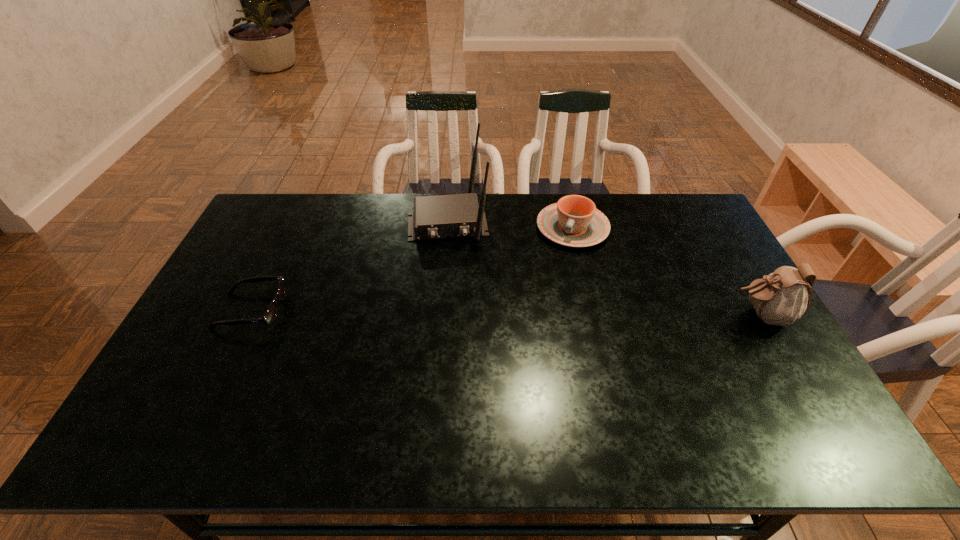
I want to click on free space on the desktop that is between the shortest object and the rightmost object and is positioned on the back of the tallest object to connect cables, so click(456, 313).

Where is `vacant spot on the desktop that is between the spectacles and the second tallest object and is positioned on the handle side of the chinaware`? The image size is (960, 540). vacant spot on the desktop that is between the spectacles and the second tallest object and is positioned on the handle side of the chinaware is located at coordinates (537, 313).